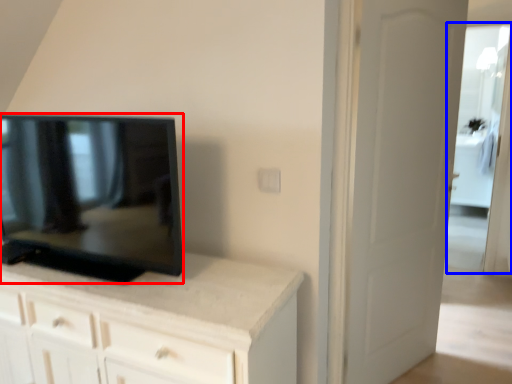
Question: Among these objects, which one is farthest to the camera, television (highlighted by a red box) or glass door (highlighted by a blue box)?

Choices:
 (A) television
 (B) glass door

Answer: (B)